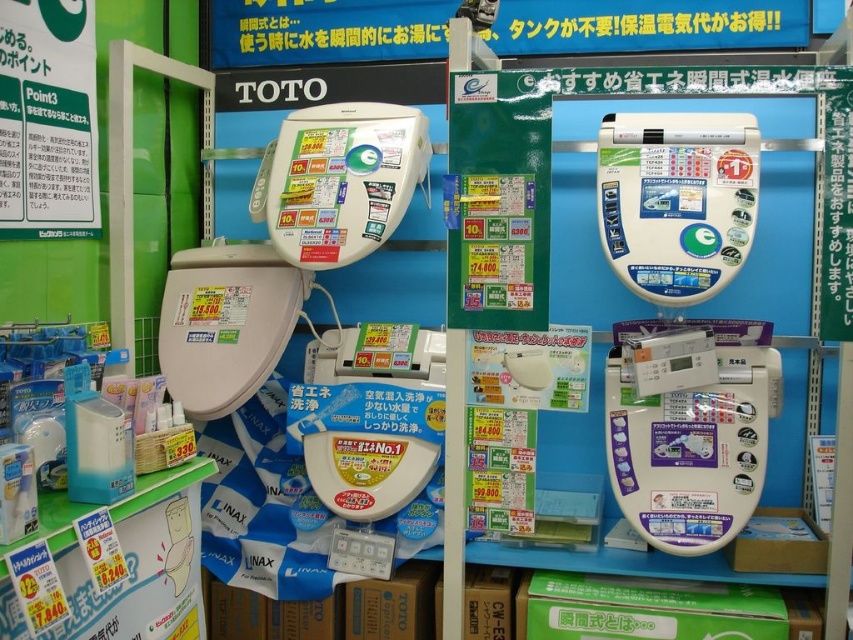
Which of these two, white glossy toilet seat at center or matte white toilet at center, stands shorter?

With less height is white glossy toilet seat at center.

Is white glossy toilet seat at center bigger than matte white toilet at center?

Actually, white glossy toilet seat at center might be smaller than matte white toilet at center.

Image resolution: width=853 pixels, height=640 pixels. I want to click on white glossy toilet seat at center, so click(691, 449).

Locate an element on the screen. This screenshot has height=640, width=853. white glossy toilet seat at center is located at coordinates (691, 449).

Between white glossy toilet seat at center and white plastic shelf at lower left, which one has less height?

Standing shorter between the two is white plastic shelf at lower left.

Which is in front, point (718, 484) or point (74, 515)?

Point (74, 515) is more forward.

Is point (735, 468) positioned behind point (67, 502)?

Yes, it is behind point (67, 502).

Identify the location of white glossy toilet seat at center. This screenshot has height=640, width=853. (691, 449).

Between white plastic shelf at lower left and matte white toilet at center, which one is positioned higher?

Positioned higher is matte white toilet at center.

In order to click on white plastic shelf at lower left in this screenshot , I will do `click(123, 564)`.

Locate an element on the screen. The height and width of the screenshot is (640, 853). white plastic shelf at lower left is located at coordinates (123, 564).